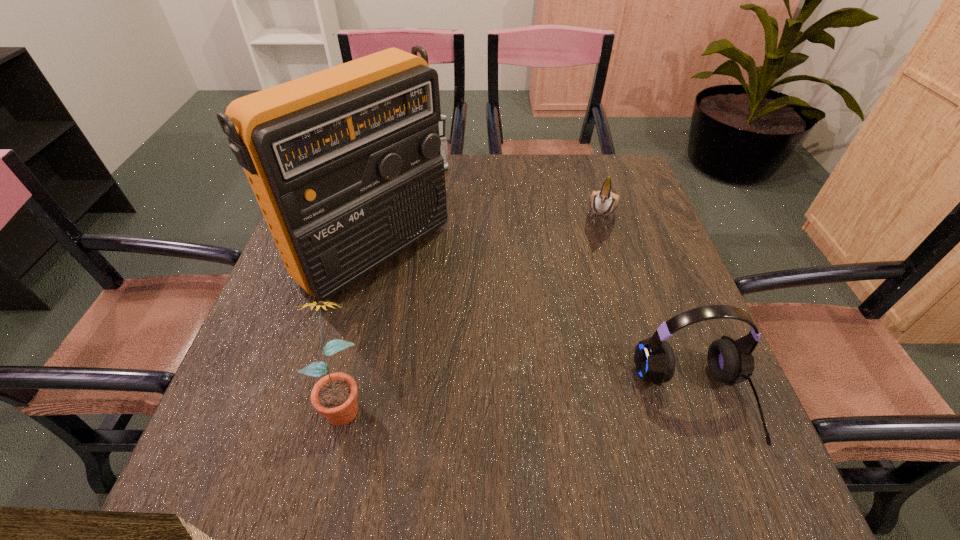
At what (x,y) coordinates should I click in order to perform the action: click on the second tallest object. Please return your answer as a coordinate pair (x, y). The height and width of the screenshot is (540, 960). Looking at the image, I should click on (334, 396).

Locate an element on the screen. Image resolution: width=960 pixels, height=540 pixels. headset is located at coordinates (730, 361).

The image size is (960, 540). In order to click on bird in this screenshot , I will do `click(603, 202)`.

What are the coordinates of `the tallest object` in the screenshot? It's located at (345, 163).

The height and width of the screenshot is (540, 960). What are the coordinates of `the farthest object` in the screenshot? It's located at (442, 124).

Identify the location of blank space located at the face of the bird. (568, 361).

At what (x,y) coordinates should I click in order to perform the action: click on free space located 0.380m at the face of the bird. Please return your answer as a coordinate pair (x, y). The image size is (960, 540). Looking at the image, I should click on (568, 361).

Identify the location of free point located 0.190m at the face of the bird. (587, 293).

This screenshot has width=960, height=540. Find the location of `free space located on the front-facing side of the tallest object`. free space located on the front-facing side of the tallest object is located at coordinates (530, 370).

In order to click on blank area located 0.400m on the front-facing side of the tallest object in this screenshot , I will do `click(568, 400)`.